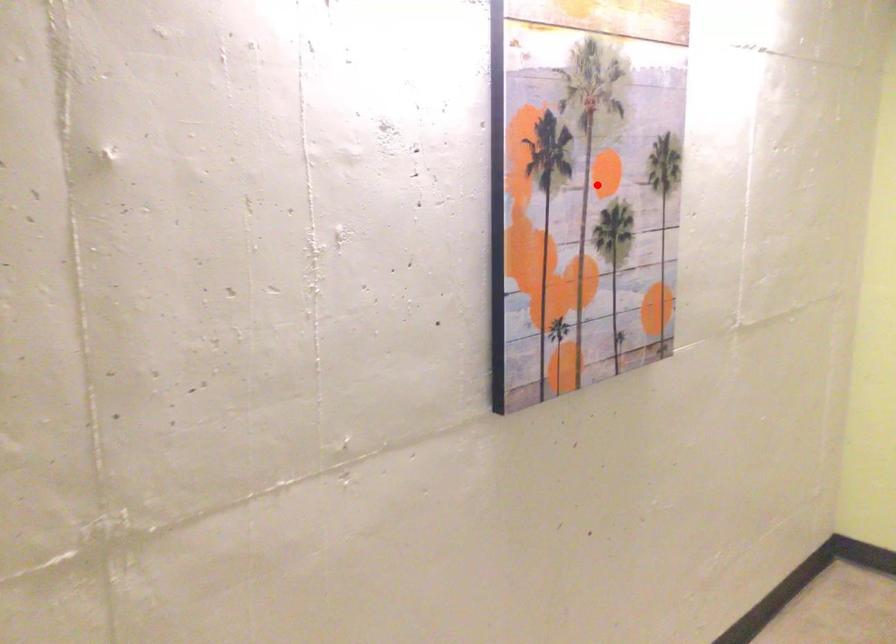
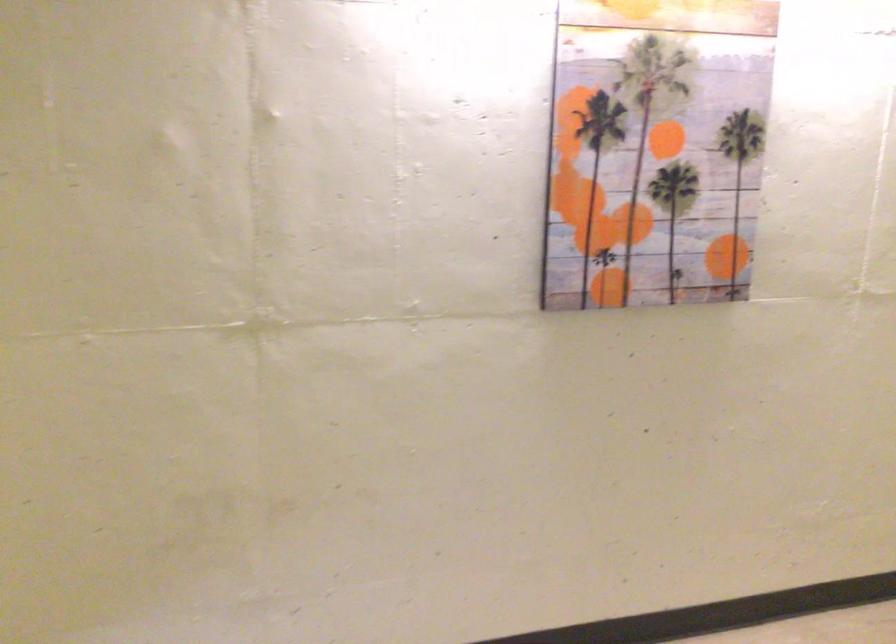
Question: A red point is marked in image1. In image2, is the corresponding 3D point closer to the camera or farther? Reply with the corresponding letter.

Choices:
 (A) The corresponding 3D point is closer.
 (B) The corresponding 3D point is farther.

Answer: (B)